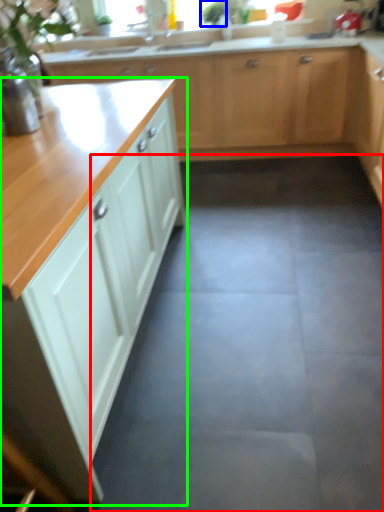
Question: Which is nearer to the concrete (highlighted by a red box)? plant (highlighted by a blue box) or cabinetry (highlighted by a green box).

Choices:
 (A) plant
 (B) cabinetry

Answer: (B)